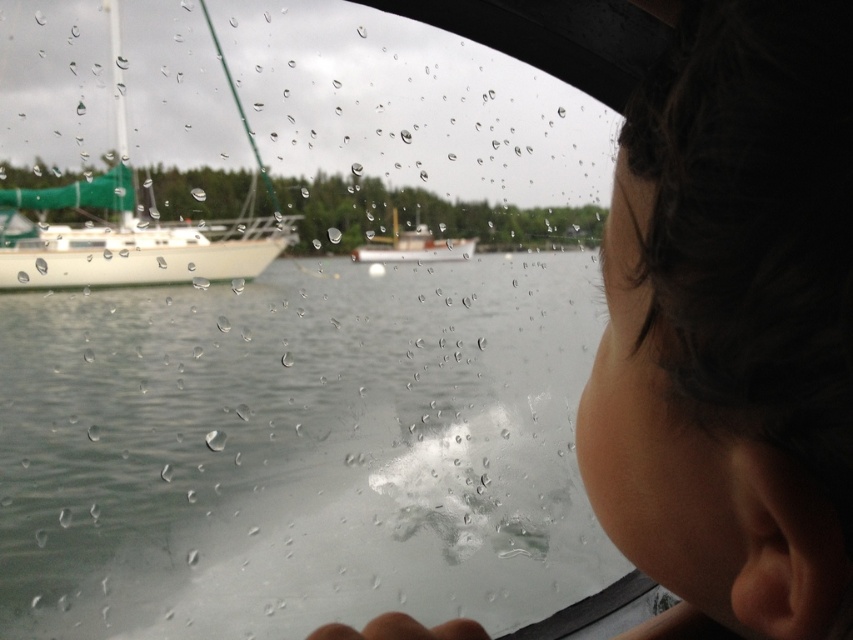
Who is more distant from viewer, (720, 416) or (236, 260)?

Positioned behind is point (236, 260).

Which is below, dark brown hair at upper right or white matte sailboat at left?

dark brown hair at upper right is below.

Measure the distance between dark brown hair at upper right and camera.

They are 9.24 inches apart.

Find the location of a particular element. The image size is (853, 640). dark brown hair at upper right is located at coordinates (732, 321).

Can you confirm if transparent glass water at center is positioned to the left of white matte boat at center?

Indeed, transparent glass water at center is positioned on the left side of white matte boat at center.

Consider the image. Who is shorter, transparent glass water at center or white matte boat at center?

white matte boat at center is shorter.

Where is `transparent glass water at center`? transparent glass water at center is located at coordinates (297, 451).

Identify the location of transparent glass water at center. (297, 451).

Is point (67, 611) positioned before point (758, 173)?

No, (67, 611) is behind (758, 173).

The height and width of the screenshot is (640, 853). I want to click on transparent glass water at center, so [x=297, y=451].